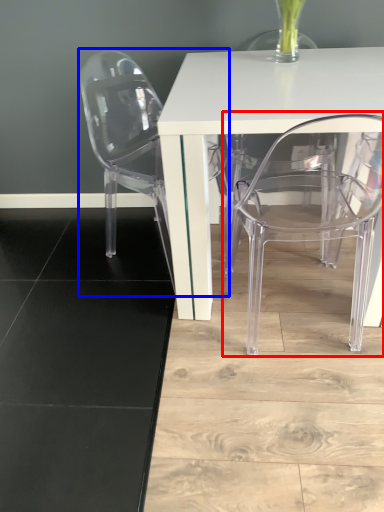
Question: Which object is further to the camera taking this photo, chair (highlighted by a red box) or chair (highlighted by a blue box)?

Choices:
 (A) chair
 (B) chair

Answer: (B)